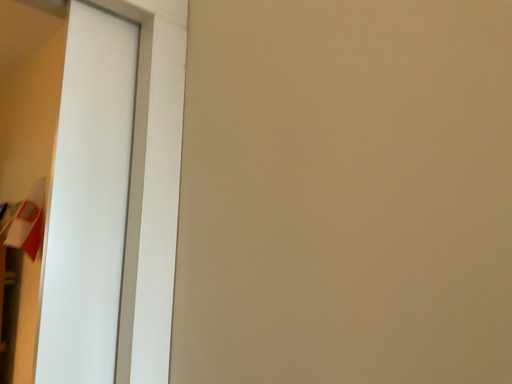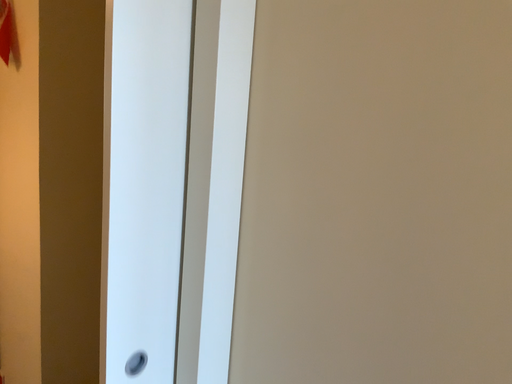
Question: Which way did the camera rotate in the video?

Choices:
 (A) rotated upward
 (B) rotated downward

Answer: (B)